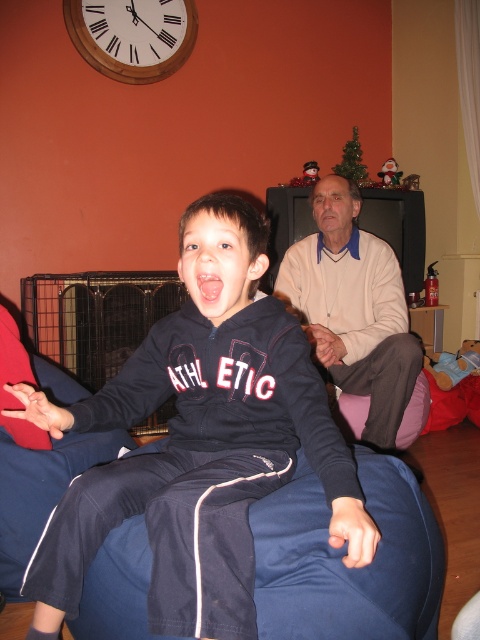
You are a fashion designer observing the festive living room scene. You notice the dark blue athletic tracksuit at center and the light beige sweater at center. Which clothing item is shorter in height?

The dark blue athletic tracksuit at center is not as tall as the light beige sweater at center, so the dark blue athletic tracksuit at center is shorter in height.

You are standing in the living room and want to place a new decorative pillow on the dark blue athletic tracksuit at center. According to the coordinates provided, where exactly should you place the pillow?

The dark blue athletic tracksuit at center is located at coordinates point (x=199, y=442), so you should place the decorative pillow at that position.

You are a guest in this living room and want to find the wooden clock at upper left. Where should you look relative to the dark blue athletic tracksuit at center?

The wooden clock at upper left is on the left side of the dark blue athletic tracksuit at center, so you should look to the left of the dark blue athletic tracksuit at center to find it.